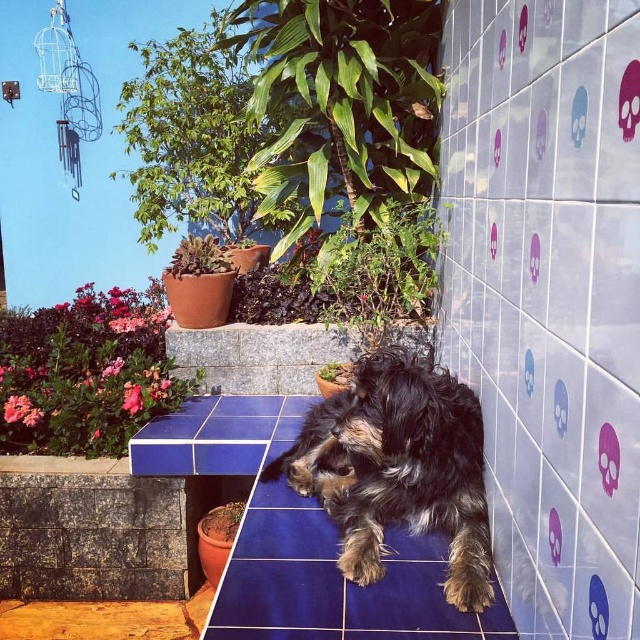
You are a small toy that is 10 cm wide. You want to place yourself on either the white glossy tile at center right or the fuzzy brown dog at center. Which surface can you fit on without overlapping the edges?

The white glossy tile at center right is thinner than the fuzzy brown dog at center, so the toy can fit on the fuzzy brown dog at center since it is wider.